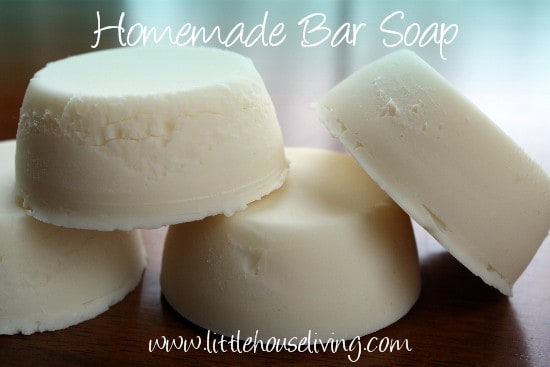
I want to click on soap, so click(x=304, y=268).